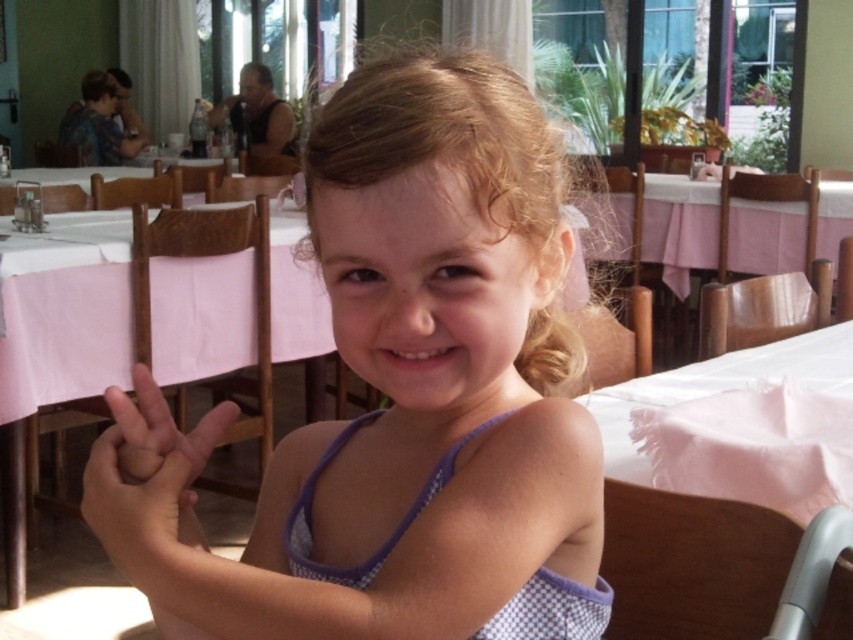
You are a photographer standing at a certain distance from the white checkered dress at center. You want to take a closeup shot of the dress without moving the dress. Can you move closer to the dress to achieve this?

The white checkered dress at center is 19.17 inches away from camera, so yes, you can move closer to the dress to take a closeup shot as long as you stay within that distance.

You are a photographer trying to focus on the white checkered dress at center and the smooth skin hand at center. Which object should you adjust your camera focus on first to ensure both are in focus?

The white checkered dress at center is closer to the viewer than the smooth skin hand at center, so you should focus on the white checkered dress at center first to ensure both are in focus.

You are a photographer trying to capture the girl in the scene. You notice the smooth skin hand at center and the pink fabric table at center. Which object is positioned closer to the camera?

The smooth skin hand at center is closer to the viewer than the pink fabric table at center, so the smooth skin hand at center is positioned closer to the camera.